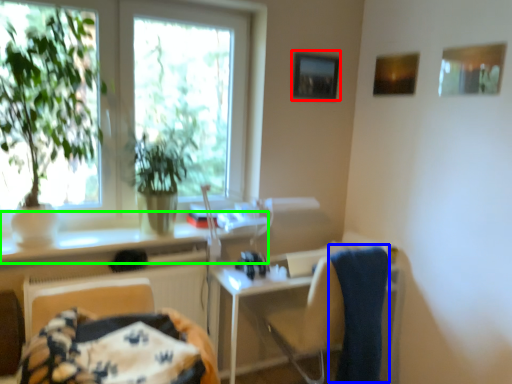
Question: Which is nearer to the picture frame (highlighted by a red box)? bath towel (highlighted by a blue box) or counter top (highlighted by a green box).

Choices:
 (A) bath towel
 (B) counter top

Answer: (B)